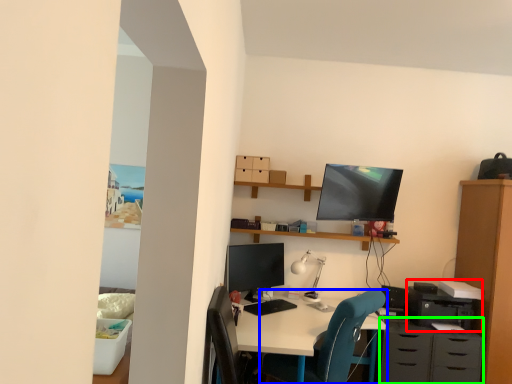
Question: Estimate the real-world distances between objects in this image. Which object is farther from printer (highlighted by a red box), chair (highlighted by a blue box) or dresser (highlighted by a green box)?

Choices:
 (A) chair
 (B) dresser

Answer: (A)